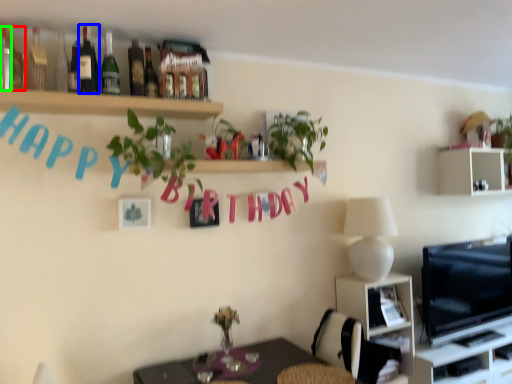
Question: Which object is positioned farthest from bottle (highlighted by a red box)? Select from bottle (highlighted by a blue box) and bottle (highlighted by a green box).

Choices:
 (A) bottle
 (B) bottle

Answer: (A)